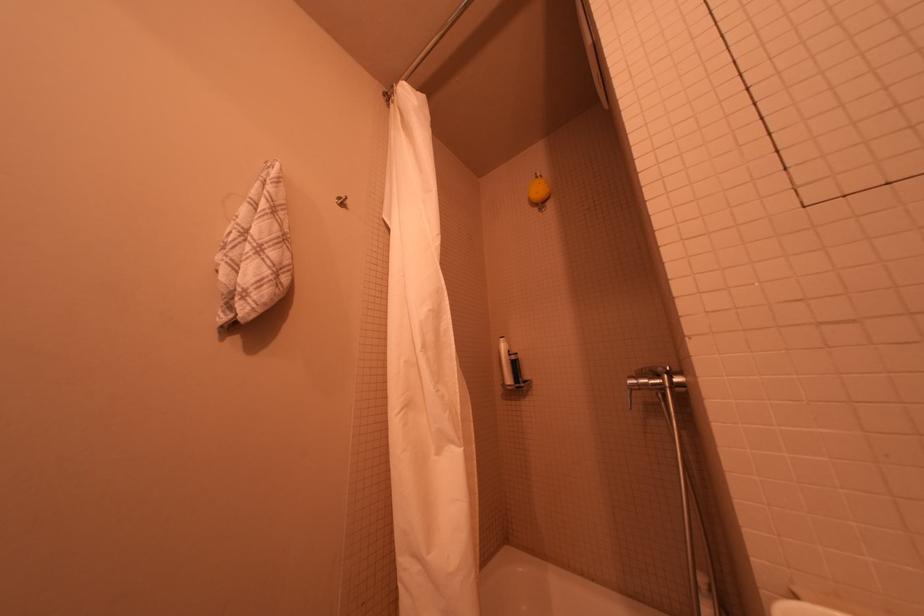
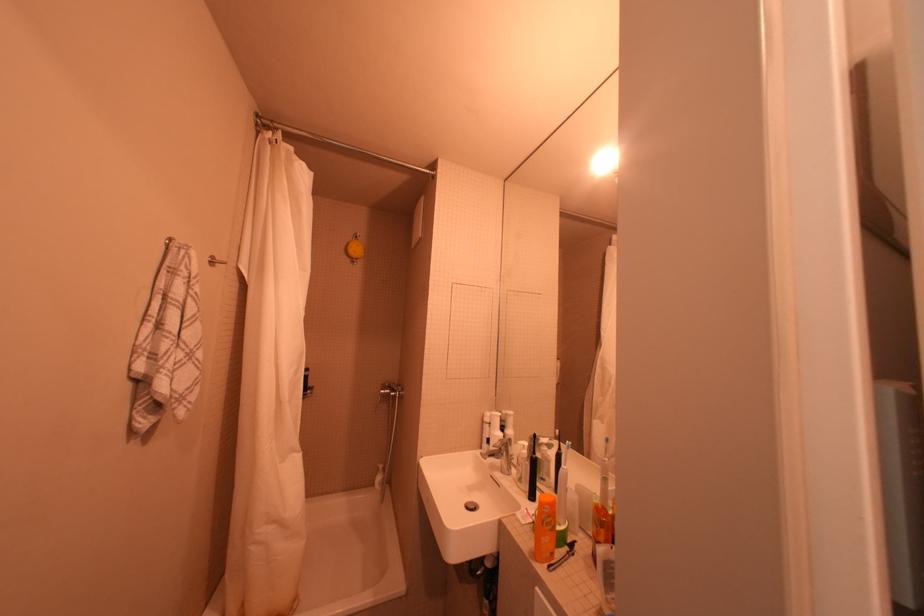
Locate, in the second image, the point that corresponds to point (641, 383) in the first image.

(391, 392)